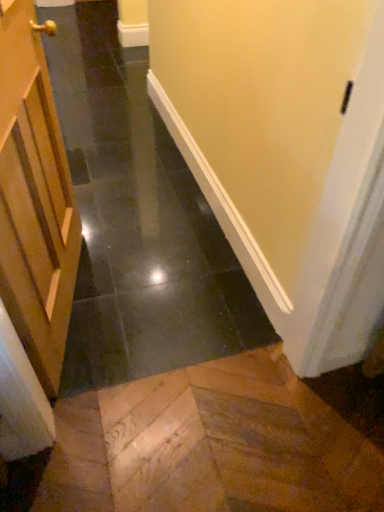
Describe the element at coordinates (137, 222) in the screenshot. I see `black glossy tile at center` at that location.

Locate an element on the screen. black glossy tile at center is located at coordinates (137, 222).

You are a GUI agent. You are given a task and a screenshot of the screen. Output one action in this format:
    pyautogui.click(x=<x>, y=<y>)
    Task: Click on the wooden door at left
    This screenshot has width=384, height=512.
    Given the screenshot: What is the action you would take?
    pyautogui.click(x=34, y=198)

The height and width of the screenshot is (512, 384). Describe the element at coordinates (34, 198) in the screenshot. I see `wooden door at left` at that location.

The width and height of the screenshot is (384, 512). I want to click on black glossy tile at center, so click(137, 222).

Can you confirm if black glossy tile at center is positioned to the left of wooden door at left?

Incorrect, black glossy tile at center is not on the left side of wooden door at left.

Considering the relative positions of black glossy tile at center and wooden door at left in the image provided, is black glossy tile at center in front of wooden door at left?

Yes, it is in front of wooden door at left.

Which point is more distant from viewer, (104, 195) or (56, 199)?

The point (104, 195) is more distant.

From the image's perspective, is black glossy tile at center located above or below wooden door at left?

Based on their image positions, black glossy tile at center is located beneath wooden door at left.

From the picture: From a real-world perspective, is black glossy tile at center positioned above or below wooden door at left?

Clearly, from a real-world perspective, black glossy tile at center is above wooden door at left.

In terms of width, does black glossy tile at center look wider or thinner when compared to wooden door at left?

In the image, black glossy tile at center appears to be wider than wooden door at left.

Considering the sizes of objects black glossy tile at center and wooden door at left in the image provided, who is taller, black glossy tile at center or wooden door at left?

black glossy tile at center.

Which of these two, black glossy tile at center or wooden door at left, is smaller?

wooden door at left.

Would you say wooden door at left is part of black glossy tile at center's contents?

No, wooden door at left is not inside black glossy tile at center.

Is black glossy tile at center not close to wooden door at left?

No.

Is black glossy tile at center oriented towards wooden door at left?

No, black glossy tile at center does not turn towards wooden door at left.

Identify the location of path in front of the wooden door at left. This screenshot has height=512, width=384. (137, 222).

In the image, is wooden door at left on the left side or the right side of black glossy tile at center?

Based on their positions, wooden door at left is located to the left of black glossy tile at center.

Which object is closer to the camera, wooden door at left or black glossy tile at center?

black glossy tile at center is in front.

Considering the positions of points (38, 86) and (116, 114), is point (38, 86) closer to camera compared to point (116, 114)?

Yes, it is in front of point (116, 114).

From the image's perspective, is wooden door at left above or below black glossy tile at center?

wooden door at left is above black glossy tile at center.

From a real-world perspective, is wooden door at left physically located above or below black glossy tile at center?

Clearly, from a real-world perspective, wooden door at left is below black glossy tile at center.

From the picture: In terms of width, does wooden door at left look wider or thinner when compared to black glossy tile at center?

wooden door at left is thinner than black glossy tile at center.

Can you confirm if wooden door at left is taller than black glossy tile at center?

Incorrect, the height of wooden door at left is not larger of that of black glossy tile at center.

Considering the sizes of objects wooden door at left and black glossy tile at center in the image provided, who is smaller, wooden door at left or black glossy tile at center?

wooden door at left is smaller.

Would you say wooden door at left contains black glossy tile at center?

Definitely not — black glossy tile at center is not inside wooden door at left.

Is wooden door at left with black glossy tile at center?

No, wooden door at left is not making contact with black glossy tile at center.

Is wooden door at left facing towards black glossy tile at center?

Yes.

What's the angular difference between wooden door at left and black glossy tile at center's facing directions?

The angle between the facing direction of wooden door at left and the facing direction of black glossy tile at center is 76.1 degrees.

Image resolution: width=384 pixels, height=512 pixels. Find the location of `path that appears above the wooden door at left (from a real-world perspective)`. path that appears above the wooden door at left (from a real-world perspective) is located at coordinates (137, 222).

You are a GUI agent. You are given a task and a screenshot of the screen. Output one action in this format:
    pyautogui.click(x=<x>, y=<y>)
    Task: Click on the door directly beneath the black glossy tile at center (from a real-world perspective)
    This screenshot has width=384, height=512.
    Given the screenshot: What is the action you would take?
    pyautogui.click(x=34, y=198)

Locate an element on the screen. This screenshot has width=384, height=512. door lying above the black glossy tile at center (from the image's perspective) is located at coordinates (34, 198).